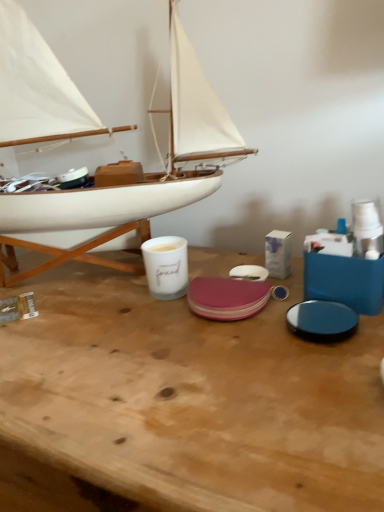
Question: From a real-world perspective, relative to wooden table at center, is white ceramic mug at center vertically above or below?

Choices:
 (A) above
 (B) below

Answer: (A)

Question: Which is correct: white ceramic mug at center is inside wooden table at center, or outside of it?

Choices:
 (A) inside
 (B) outside

Answer: (B)

Question: Which object is positioned closest to the white ceramic mug at center?

Choices:
 (A) wooden table at center
 (B) white wood boat at left

Answer: (A)

Question: Based on their relative distances, which object is farther from the white wood boat at left?

Choices:
 (A) white ceramic mug at center
 (B) wooden table at center

Answer: (B)